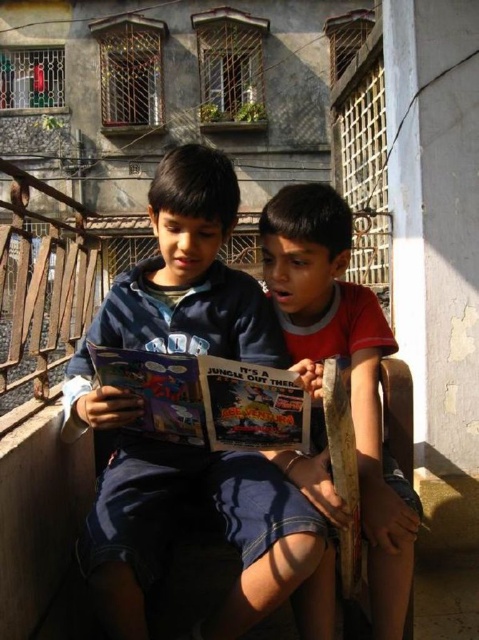
Question: Is matte red shirt at center positioned before matte plastic comic book at center?

Choices:
 (A) no
 (B) yes

Answer: (A)

Question: Which object is the farthest from the matte red shirt at center?

Choices:
 (A) matte plastic comic book at center
 (B) blue cotton shirt at center

Answer: (B)

Question: Is blue cotton shirt at center to the left of matte red shirt at center from the viewer's perspective?

Choices:
 (A) no
 (B) yes

Answer: (B)

Question: Observing the image, what is the correct spatial positioning of blue cotton shirt at center in reference to matte red shirt at center?

Choices:
 (A) right
 (B) left

Answer: (B)

Question: Among these points, which one is farthest from the camera?

Choices:
 (A) [x=315, y=426]
 (B) [x=148, y=211]
 (C) [x=125, y=372]

Answer: (B)

Question: Which of these objects is positioned farthest from the blue cotton shirt at center?

Choices:
 (A) matte plastic comic book at center
 (B) matte red shirt at center

Answer: (B)